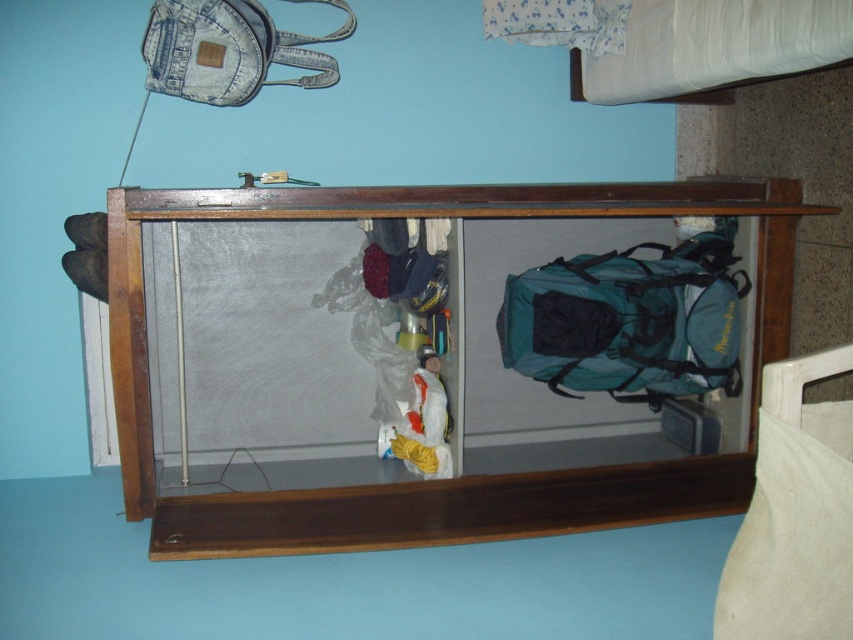
Question: Which of these objects is positioned closest to the wooden shelf at center?

Choices:
 (A) teal fabric backpack at center-right
 (B) denim backpack at upper left

Answer: (A)

Question: Can you confirm if teal fabric backpack at center-right is smaller than white cotton pillow at lower right?

Choices:
 (A) yes
 (B) no

Answer: (B)

Question: Which point is farther to the camera?

Choices:
 (A) wooden shelf at center
 (B) white cotton pillow at lower right
 (C) denim backpack at upper left

Answer: (C)

Question: Is white cotton pillow at lower right smaller than denim backpack at upper left?

Choices:
 (A) no
 (B) yes

Answer: (B)

Question: Is wooden shelf at center closer to camera compared to white cotton pillow at lower right?

Choices:
 (A) yes
 (B) no

Answer: (B)

Question: Which object is the closest to the wooden shelf at center?

Choices:
 (A) white cotton pillow at lower right
 (B) teal fabric backpack at center-right

Answer: (B)